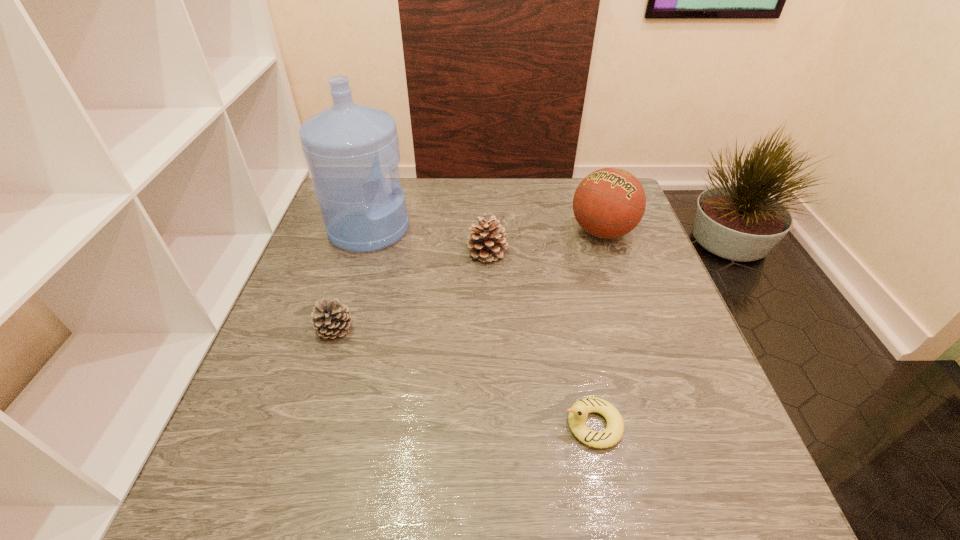
Where is `object located at the far left corner`? The height and width of the screenshot is (540, 960). object located at the far left corner is located at coordinates (349, 148).

You are a GUI agent. You are given a task and a screenshot of the screen. Output one action in this format:
    pyautogui.click(x=<x>, y=<y>)
    Task: Click on the object that is positioned at the far right corner
    
    Given the screenshot: What is the action you would take?
    pyautogui.click(x=610, y=202)

The height and width of the screenshot is (540, 960). Find the location of `vacant space at the far edge of the desktop`. vacant space at the far edge of the desktop is located at coordinates (510, 191).

Find the location of `vacant space at the left edge`. vacant space at the left edge is located at coordinates (300, 270).

Locate an element on the screen. Image resolution: width=960 pixels, height=540 pixels. free space at the right edge of the desktop is located at coordinates (697, 366).

Locate an element on the screen. free region at the near right corner is located at coordinates (766, 511).

You are a GUI agent. You are given a task and a screenshot of the screen. Output one action in this format:
    pyautogui.click(x=<x>, y=<y>)
    Task: Click on the free space between the duckling and the tallest object
    Image resolution: width=960 pixels, height=540 pixels.
    Given the screenshot: What is the action you would take?
    pyautogui.click(x=481, y=327)

At what (x,y) coordinates should I click in order to perform the action: click on free space between the fourth tallest object and the third shortest object. Please return your answer as a coordinate pair (x, y). Looking at the image, I should click on (411, 292).

Find the location of a particular element. This screenshot has width=960, height=540. vacant space in between the fourth shortest object and the duckling is located at coordinates (597, 328).

In order to click on free space between the fourth farthest object and the shortest object in this screenshot , I will do `click(464, 377)`.